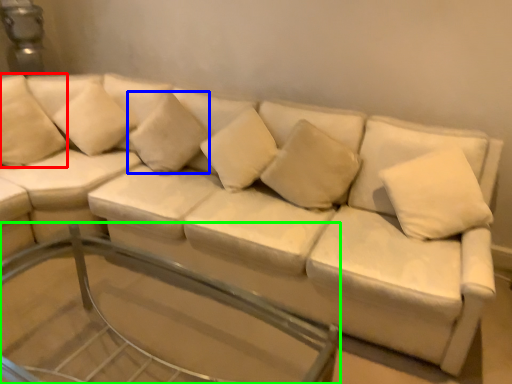
Question: Based on their relative distances, which object is nearer to pillow (highlighted by a red box)? Choose from pillow (highlighted by a blue box) and glass table (highlighted by a green box).

Choices:
 (A) pillow
 (B) glass table

Answer: (A)